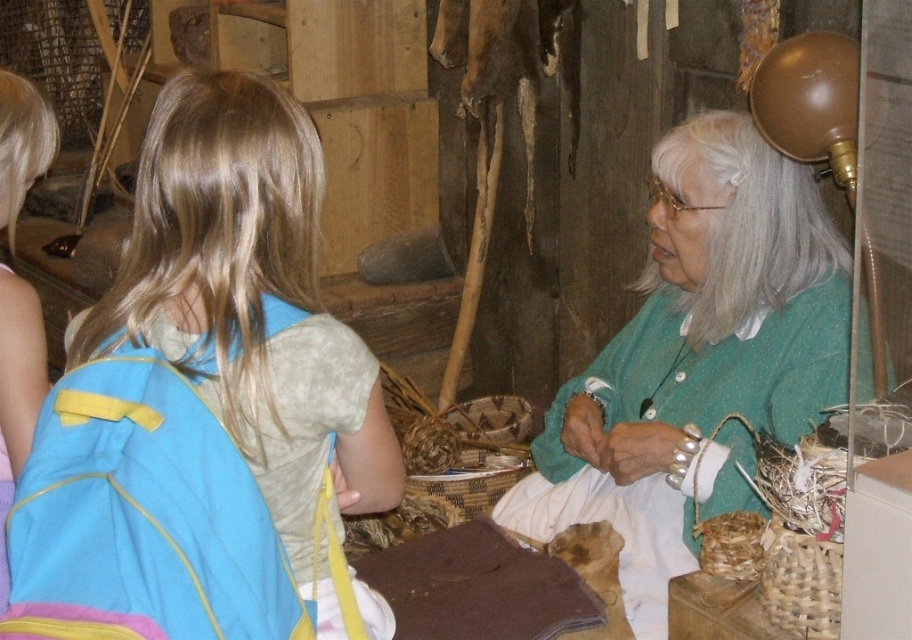
You are a tailor observing the green knitted sweater at upper right and the blue fabric backpack at left in the image. Which item requires more fabric to make?

The green knitted sweater at upper right requires more fabric to make because it is larger in size than the blue fabric backpack at left.

You are a tour guide at this historical exhibit and need to ensure that visitors can easily see all displayed items. A visitor asks if the blue fabric backpack at left is blocking the view of the green knitted sweater at upper right. How would you respond?

The blue fabric backpack at left is behind the green knitted sweater at upper right, so it is not blocking the view of the sweater. Visitors can see the green knitted sweater at upper right clearly.

You are a tour guide in this rustic museum exhibit. You need to ensure visitors can comfortably walk between the green knitted sweater at upper right and the blue fabric backpack at left. The path between them is 30.32 inches wide. If a visitor is carrying a large tablet that is 18 inches wide, will there be enough space for them to pass through comfortably?

The path between the green knitted sweater at upper right and the blue fabric backpack at left is 30.32 inches wide. Since the tablet is 18 inches wide, there will be sufficient space for the visitor to pass through comfortably.